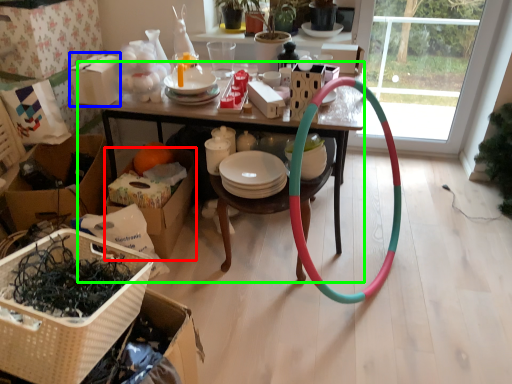
Question: Which is farther away from cardboard box (highlighted by a red box)? cardboard box (highlighted by a blue box) or desk (highlighted by a green box)?

Choices:
 (A) cardboard box
 (B) desk

Answer: (A)